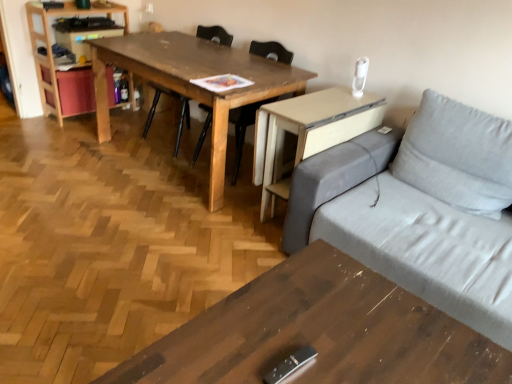
Question: Does beige wood computer desk at right have a greater height compared to wooden chair at center, acting as the 2th chair starting from the left?

Choices:
 (A) yes
 (B) no

Answer: (B)

Question: Are beige wood computer desk at right and wooden chair at center, acting as the 2th chair starting from the left, located far from each other?

Choices:
 (A) yes
 (B) no

Answer: (B)

Question: Can you confirm if beige wood computer desk at right is smaller than wooden chair at center, acting as the 2th chair starting from the left?

Choices:
 (A) no
 (B) yes

Answer: (B)

Question: Are beige wood computer desk at right and wooden chair at center, acting as the 2th chair starting from the left, beside each other?

Choices:
 (A) no
 (B) yes

Answer: (A)

Question: Can you confirm if beige wood computer desk at right is bigger than wooden chair at center, which ranks as the first chair in right-to-left order?

Choices:
 (A) no
 (B) yes

Answer: (A)

Question: Is the position of beige wood computer desk at right more distant than that of wooden chair at center, which ranks as the first chair in right-to-left order?

Choices:
 (A) yes
 (B) no

Answer: (B)

Question: Does wooden table at center, the first table viewed from the top, lie in front of light wood bookshelf at left?

Choices:
 (A) no
 (B) yes

Answer: (B)

Question: Is wooden table at center, which is counted as the 2th table, starting from the bottom, not near light wood bookshelf at left?

Choices:
 (A) yes
 (B) no

Answer: (B)

Question: From a real-world perspective, does wooden table at center, the first table viewed from the top, stand above light wood bookshelf at left?

Choices:
 (A) yes
 (B) no

Answer: (B)

Question: From the image's perspective, does wooden table at center, the second table in the front-to-back sequence, appear lower than light wood bookshelf at left?

Choices:
 (A) no
 (B) yes

Answer: (B)

Question: Does wooden table at center, which is counted as the 2th table, starting from the bottom, have a smaller size compared to light wood bookshelf at left?

Choices:
 (A) no
 (B) yes

Answer: (A)

Question: Is wooden table at center, the first table viewed from the top, not within light wood bookshelf at left?

Choices:
 (A) yes
 (B) no

Answer: (A)

Question: Would you say wooden coffee table at lower center, the 1th table viewed from the front, is outside wooden chair at center, the first chair when ordered from left to right?

Choices:
 (A) no
 (B) yes

Answer: (B)